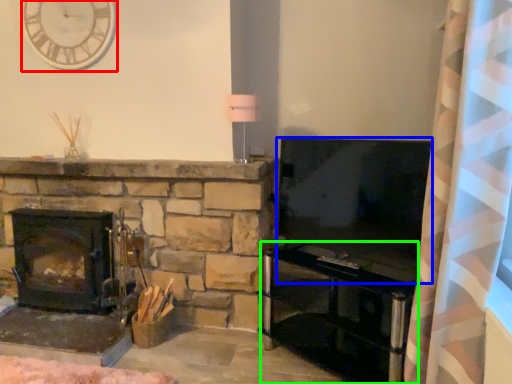
Question: Based on their relative distances, which object is nearer to clock (highlighted by a red box)? Choose from television (highlighted by a blue box) and entertainment center (highlighted by a green box).

Choices:
 (A) television
 (B) entertainment center

Answer: (A)